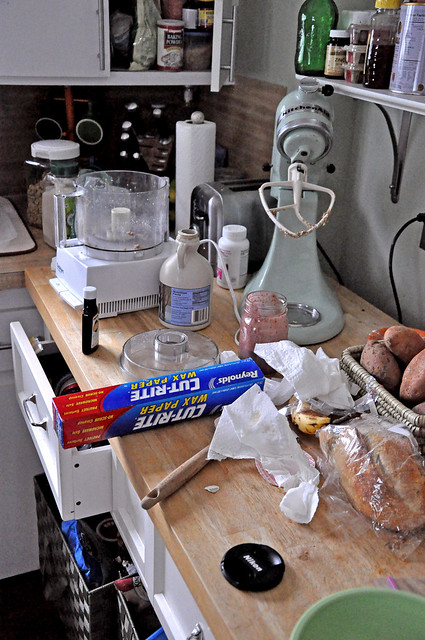
Where is `open drawer`? The image size is (425, 640). open drawer is located at coordinates (41, 385).